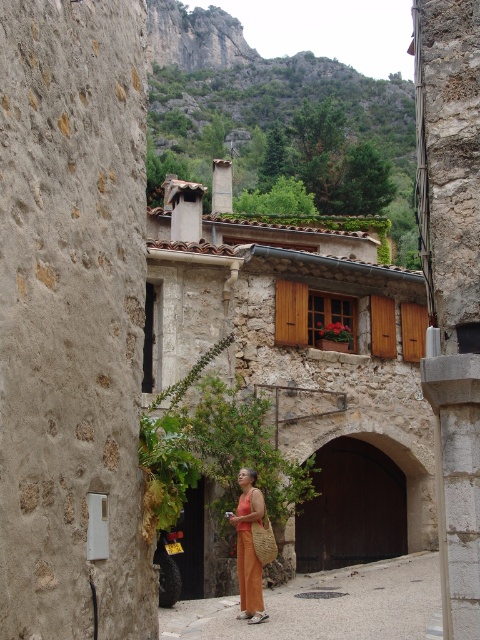
You are a traveler standing in front of the stone building and you see an orange woven bag at center and an orange woven dress at center. Which item is placed on top of the other?

The orange woven bag at center is positioned over orange woven dress at center.

You are standing in front of the stone building with the open window and potted plant. There are two points marked on the wall. Which point is closer to you, point 1 at coordinates (399,556) or point 2 at coordinates (238,536)?

Point 1 at coordinates (399,556) is closer to you because it is further to the viewer than point 2 at coordinates (238,536).

You are a delivery person with a large package that requires placing it on the ground. You see the stone textured building at center and the orange woven bag at center. Which object is wider so that you can place the package next to the wider one?

The stone textured building at center is wider than the orange woven bag at center, so you should place the package next to the stone textured building at center.